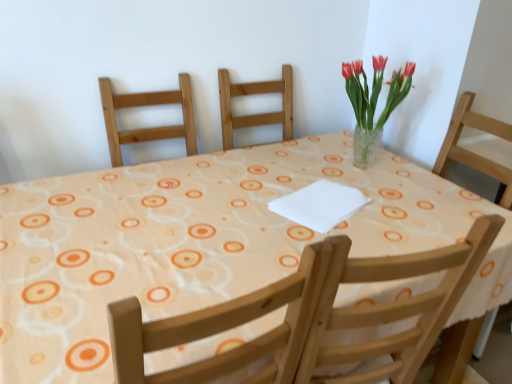
Question: Is white fabric at center closer to camera compared to clear glass vase at upper right?

Choices:
 (A) yes
 (B) no

Answer: (A)

Question: Is clear glass vase at upper right completely or partially inside white fabric at center?

Choices:
 (A) yes
 (B) no

Answer: (B)

Question: Is white fabric at center looking in the opposite direction of clear glass vase at upper right?

Choices:
 (A) yes
 (B) no

Answer: (B)

Question: Can you confirm if white fabric at center is positioned to the right of clear glass vase at upper right?

Choices:
 (A) yes
 (B) no

Answer: (B)

Question: Considering the relative positions of white fabric at center and clear glass vase at upper right in the image provided, is white fabric at center to the left of clear glass vase at upper right from the viewer's perspective?

Choices:
 (A) yes
 (B) no

Answer: (A)

Question: From the image's perspective, relative to wooden chair at upper center, is white fabric at center above or below?

Choices:
 (A) below
 (B) above

Answer: (A)

Question: Based on their sizes in the image, would you say white fabric at center is bigger or smaller than wooden chair at upper center?

Choices:
 (A) small
 (B) big

Answer: (A)

Question: Is white fabric at center in front of or behind wooden chair at upper center in the image?

Choices:
 (A) front
 (B) behind

Answer: (A)

Question: Is point (459, 223) positioned closer to the camera than point (472, 244)?

Choices:
 (A) closer
 (B) farther

Answer: (B)

Question: Is clear glass vase at upper right taller or shorter than white fabric at center?

Choices:
 (A) tall
 (B) short

Answer: (B)

Question: In terms of width, does clear glass vase at upper right look wider or thinner when compared to white fabric at center?

Choices:
 (A) thin
 (B) wide

Answer: (A)

Question: From the image's perspective, is clear glass vase at upper right above or below white fabric at center?

Choices:
 (A) above
 (B) below

Answer: (A)

Question: Considering the positions of point tap(359, 102) and point tap(188, 279), is point tap(359, 102) closer or farther from the camera than point tap(188, 279)?

Choices:
 (A) farther
 (B) closer

Answer: (A)

Question: Does point (392, 77) appear closer or farther from the camera than point (359, 344)?

Choices:
 (A) closer
 (B) farther

Answer: (B)

Question: Based on their positions, is clear glass vase at upper right located to the left or right of wooden chair at upper center?

Choices:
 (A) right
 (B) left

Answer: (B)